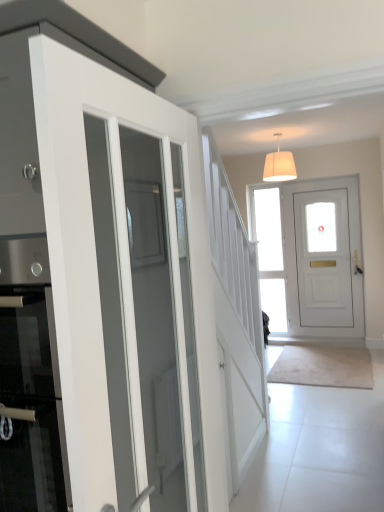
Find the location of a particular element. This screenshot has height=512, width=384. vacant space underneath white fabric lampshade at upper center (from a real-world perspective) is located at coordinates (296, 369).